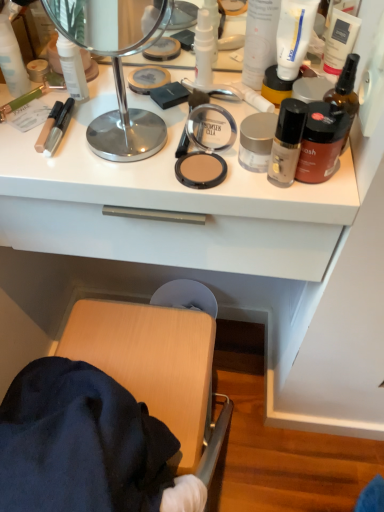
At what (x,y) coordinates should I click in order to perform the action: click on vacant space that's between matte white lotion at upper left, which is counted as the tenth toiletry, starting from the right, and white matte spray bottle at center, which appears as the third toiletry when viewed from the left. Please return your answer as a coordinate pair (x, y). Image resolution: width=384 pixels, height=512 pixels. Looking at the image, I should click on (115, 87).